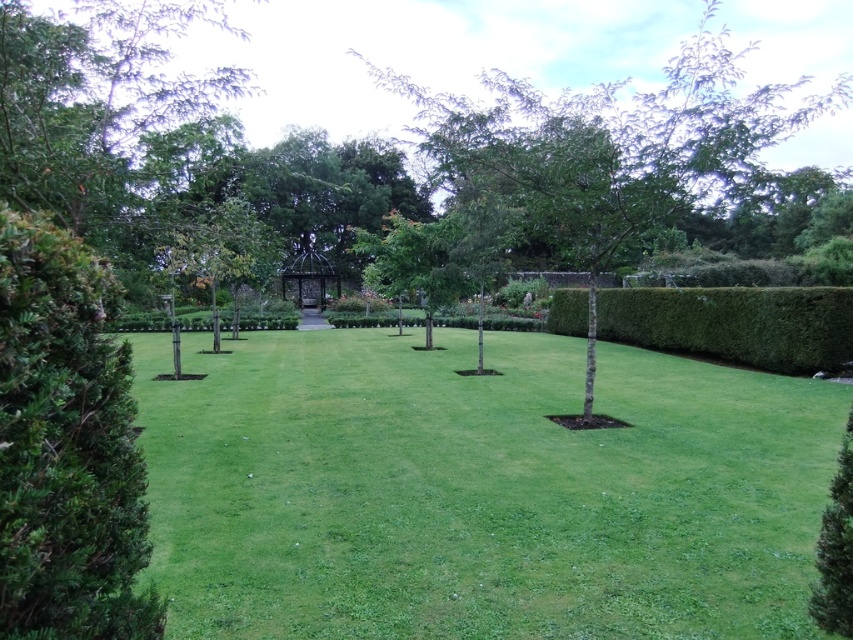
Is green grass at center to the left of green leafy tree at center from the viewer's perspective?

Correct, you'll find green grass at center to the left of green leafy tree at center.

Does green grass at center appear over green leafy tree at center?

No, green grass at center is not above green leafy tree at center.

Between point (386, 429) and point (521, 161), which one is positioned in front?

Positioned in front is point (521, 161).

Where is `green grass at center`? green grass at center is located at coordinates pyautogui.click(x=479, y=490).

Where is `green grass at center`? The height and width of the screenshot is (640, 853). green grass at center is located at coordinates (479, 490).

Which is behind, point (488, 419) or point (698, 353)?

The point (698, 353) is more distant.

What are the coordinates of `green grass at center` in the screenshot? It's located at (479, 490).

Which is more to the right, green leafy tree at center or metallic gazebo at center?

Positioned to the right is green leafy tree at center.

Does green leafy tree at center have a smaller size compared to metallic gazebo at center?

Actually, green leafy tree at center might be larger than metallic gazebo at center.

Which is in front, point (579, 262) or point (293, 259)?

Positioned in front is point (579, 262).

Locate an element on the screen. green leafy tree at center is located at coordinates (607, 150).